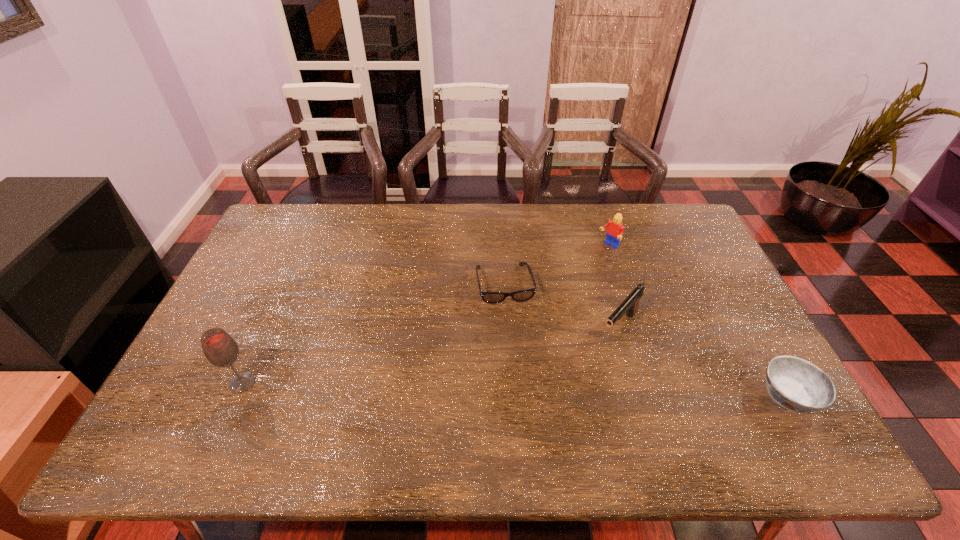
Image resolution: width=960 pixels, height=540 pixels. I want to click on object that is the closest to the farthest object, so click(x=523, y=295).

Select which object appears as the second closest to the fourth object from right to left. Please provide its 2D coordinates. Your answer should be formatted as a tuple, i.e. [(x, y)], where the tuple contains the x and y coordinates of a point satisfying the conditions above.

[(614, 232)]

Locate an element on the screen. free space that satisfies the following two spatial constraints: 1. on the front side of the ashtray; 2. on the right side of the spectacles is located at coordinates (511, 396).

Identify the location of vacant region that satisfies the following two spatial constraints: 1. on the back side of the spectacles; 2. on the left side of the tallest object. (286, 285).